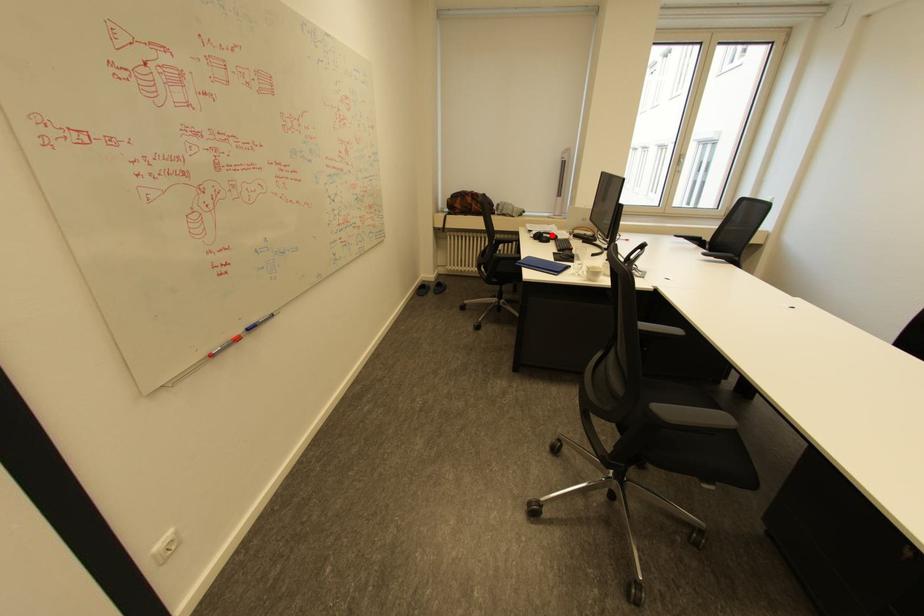
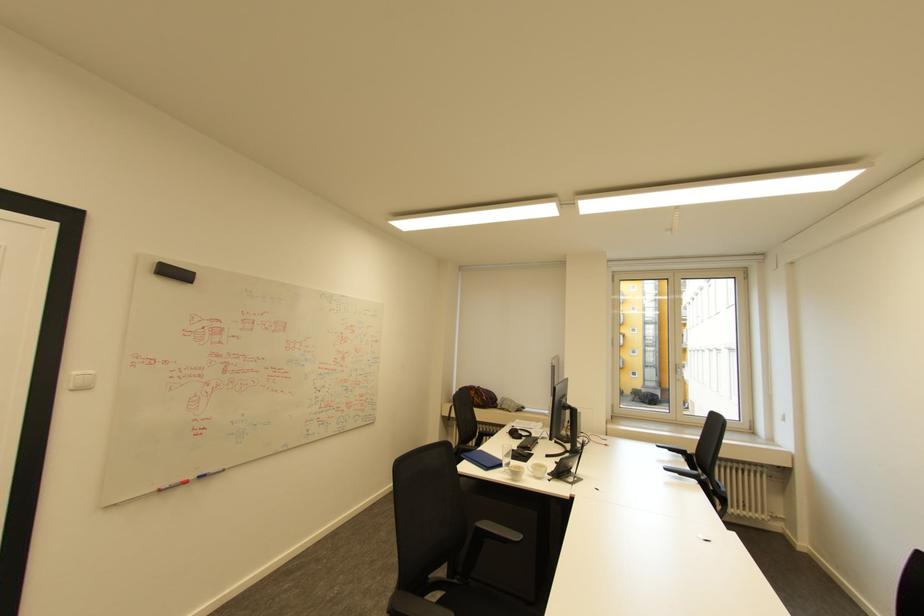
Locate, in the second image, the point that corresponds to the highlighted location in the first image.

(526, 432)